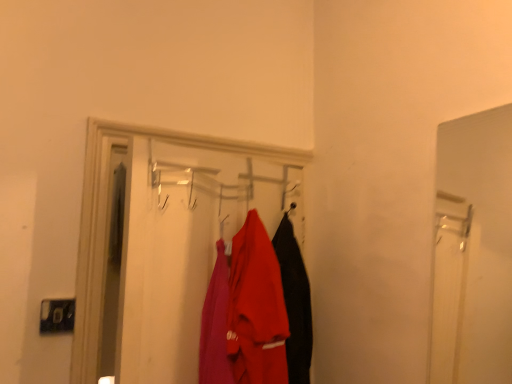
Question: Considering the relative positions of matte red shirt at center and matte plastic coat rack at center in the image provided, is matte red shirt at center to the left of matte plastic coat rack at center from the viewer's perspective?

Choices:
 (A) yes
 (B) no

Answer: (B)

Question: Is matte red shirt at center located outside matte plastic coat rack at center?

Choices:
 (A) no
 (B) yes

Answer: (A)

Question: Would you say matte red shirt at center is a long distance from matte plastic coat rack at center?

Choices:
 (A) no
 (B) yes

Answer: (A)

Question: Does matte red shirt at center come in front of matte plastic coat rack at center?

Choices:
 (A) yes
 (B) no

Answer: (B)

Question: From the image's perspective, would you say matte red shirt at center is shown under matte plastic coat rack at center?

Choices:
 (A) yes
 (B) no

Answer: (A)

Question: Is matte red shirt at center to the right of matte plastic coat rack at center from the viewer's perspective?

Choices:
 (A) yes
 (B) no

Answer: (A)

Question: Considering the relative sizes of matte plastic coat rack at center and matte red shirt at center in the image provided, is matte plastic coat rack at center smaller than matte red shirt at center?

Choices:
 (A) no
 (B) yes

Answer: (A)

Question: Could you tell me if matte plastic coat rack at center is facing matte red shirt at center?

Choices:
 (A) no
 (B) yes

Answer: (B)

Question: Can you confirm if matte plastic coat rack at center is shorter than matte red shirt at center?

Choices:
 (A) yes
 (B) no

Answer: (B)

Question: Is matte plastic coat rack at center taller than matte red shirt at center?

Choices:
 (A) no
 (B) yes

Answer: (B)

Question: Considering the relative sizes of matte plastic coat rack at center and matte red shirt at center in the image provided, is matte plastic coat rack at center thinner than matte red shirt at center?

Choices:
 (A) yes
 (B) no

Answer: (A)

Question: From a real-world perspective, is matte plastic coat rack at center on top of matte red shirt at center?

Choices:
 (A) no
 (B) yes

Answer: (B)

Question: From the image's perspective, is matte red shirt at center positioned above or below matte plastic coat rack at center?

Choices:
 (A) below
 (B) above

Answer: (A)